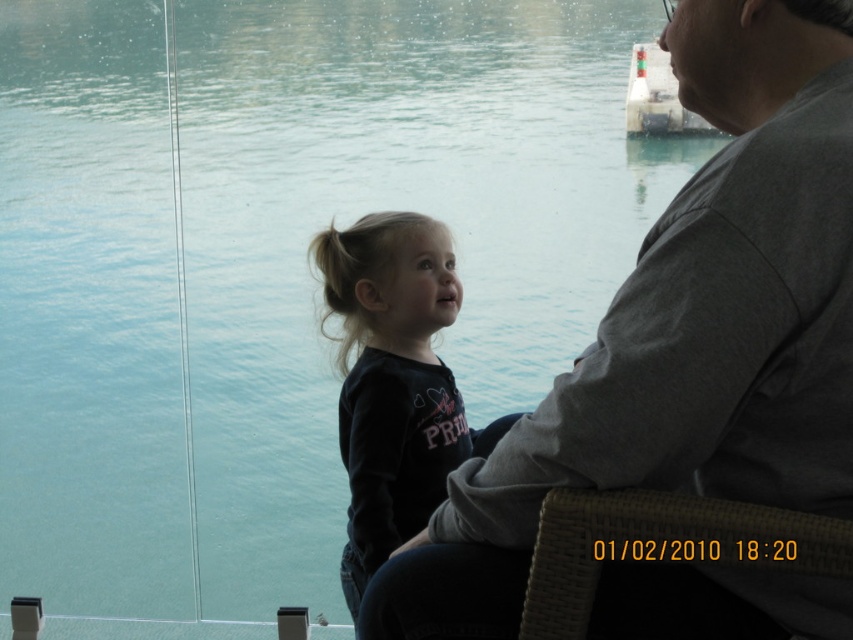
You are a photographer trying to capture a photo of the gray fabric shirt at upper right and the green striped buoy at upper right. The camera you are using has a maximum focus range of 3 meters. Will you be able to focus on both objects simultaneously?

The gray fabric shirt at upper right and the green striped buoy at upper right are 3.26 meters apart from each other. Since the camera can only focus within 3 meters, the distance between them exceeds the maximum focus range. Therefore, you cannot focus on both objects simultaneously.